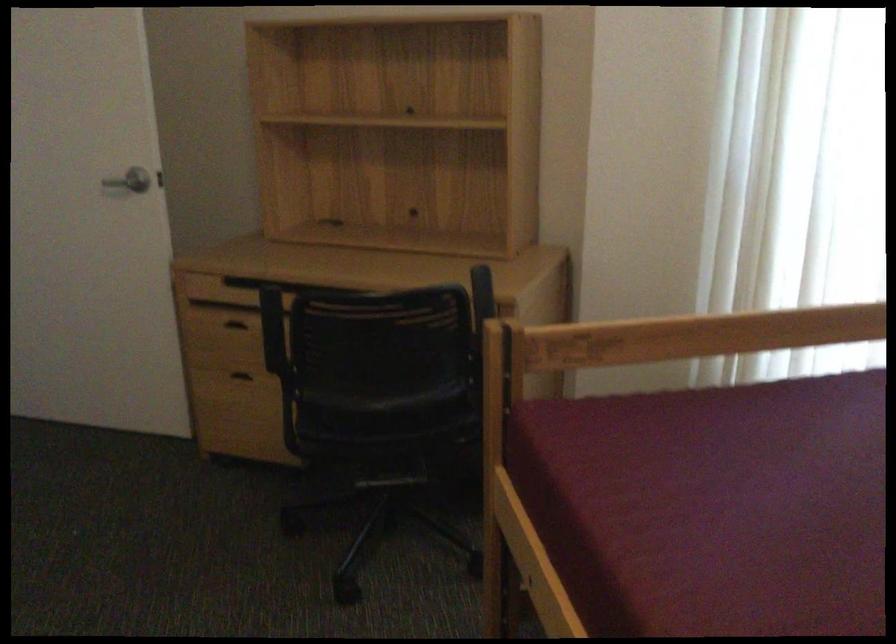
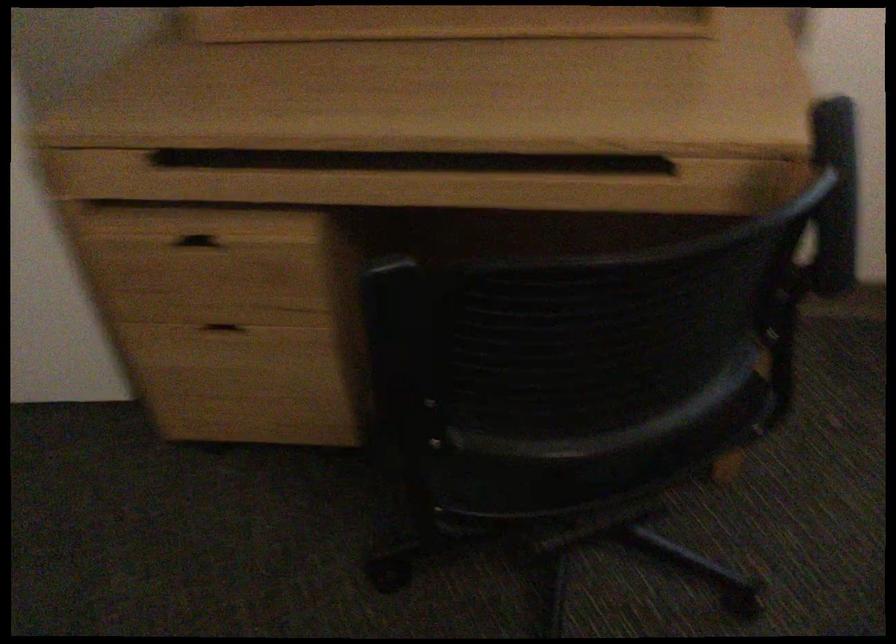
In the scene shown: In a continuous first-person perspective shot, in which direction is the camera moving?

The cameraman walked toward left, forward.